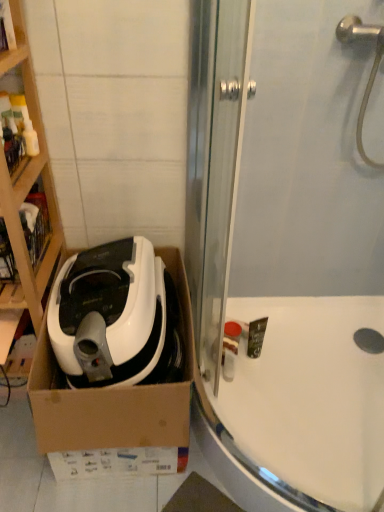
This screenshot has width=384, height=512. What do you see at coordinates (28, 190) in the screenshot? I see `white cardboard box at left` at bounding box center [28, 190].

Where is `white cardboard box at left`? white cardboard box at left is located at coordinates (28, 190).

From the image's perspective, would you say white glossy bathtub at lower right is positioned over transparent glass shower door at upper center?

No, from the image's perspective, white glossy bathtub at lower right is not above transparent glass shower door at upper center.

Is the depth of white glossy bathtub at lower right greater than that of transparent glass shower door at upper center?

Yes, it is.

Is white glossy bathtub at lower right with transparent glass shower door at upper center?

No, white glossy bathtub at lower right is not beside transparent glass shower door at upper center.

Can you tell me how much white glossy bathtub at lower right and transparent glass shower door at upper center differ in facing direction?

The angular difference between white glossy bathtub at lower right and transparent glass shower door at upper center is 41.1 degrees.

Considering the sizes of objects transparent glass shower door at upper center and white matte/soft plastic at left in the image provided, who is shorter, transparent glass shower door at upper center or white matte/soft plastic at left?

white matte/soft plastic at left is shorter.

Is transparent glass shower door at upper center at the left side of white matte/soft plastic at left?

No.

From the image's perspective, is transparent glass shower door at upper center located beneath white matte/soft plastic at left?

No, from the image's perspective, transparent glass shower door at upper center is not below white matte/soft plastic at left.

Which is behind, transparent glass shower door at upper center or white cardboard box at left?

Result: white cardboard box at left.

Is transparent glass shower door at upper center situated inside white cardboard box at left or outside?

transparent glass shower door at upper center lies outside white cardboard box at left.

Identify the location of cabinetry that is behind the transparent glass shower door at upper center. This screenshot has height=512, width=384. (28, 190).

Does point (191, 84) lie in front of point (48, 162)?

Yes.

Find the location of a particular element. This screenshot has height=512, width=384. bath that appears below the white matte/soft plastic at left (from a real-world perspective) is located at coordinates (300, 408).

Looking at their sizes, would you say white glossy bathtub at lower right is wider or thinner than white matte/soft plastic at left?

white glossy bathtub at lower right is wider than white matte/soft plastic at left.

Is white glossy bathtub at lower right positioned with its back to white matte/soft plastic at left?

No, white matte/soft plastic at left is not at the back of white glossy bathtub at lower right.

Considering the relative sizes of white cardboard box at left and white glossy bathtub at lower right in the image provided, is white cardboard box at left thinner than white glossy bathtub at lower right?

Correct, the width of white cardboard box at left is less than that of white glossy bathtub at lower right.

Is white cardboard box at left oriented towards white glossy bathtub at lower right?

No, white cardboard box at left is not oriented towards white glossy bathtub at lower right.

Is white cardboard box at left at the right side of white glossy bathtub at lower right?

In fact, white cardboard box at left is to the left of white glossy bathtub at lower right.

In the scene shown: Is white matte/soft plastic at left at the right side of white glossy bathtub at lower right?

No, white matte/soft plastic at left is not to the right of white glossy bathtub at lower right.

From the image's perspective, is white matte/soft plastic at left over white glossy bathtub at lower right?

Indeed, from the image's perspective, white matte/soft plastic at left is shown above white glossy bathtub at lower right.

From a real-world perspective, is white matte/soft plastic at left below white glossy bathtub at lower right?

No, from a real-world perspective, white matte/soft plastic at left is not under white glossy bathtub at lower right.

Which is in front, white cardboard box at left or white matte/soft plastic at left?

white cardboard box at left is more forward.

What's the angular difference between white cardboard box at left and white matte/soft plastic at left's facing directions?

1.8 degrees.

Could you tell me if white cardboard box at left is facing white matte/soft plastic at left?

No, white cardboard box at left is not oriented towards white matte/soft plastic at left.

From a real-world perspective, is white cardboard box at left positioned above or below white matte/soft plastic at left?

Clearly, from a real-world perspective, white cardboard box at left is above white matte/soft plastic at left.

At what (x,y) coordinates should I click in order to perform the action: click on bath behind the transparent glass shower door at upper center. Please return your answer as a coordinate pair (x, y). Image resolution: width=384 pixels, height=512 pixels. Looking at the image, I should click on (300, 408).

You are a GUI agent. You are given a task and a screenshot of the screen. Output one action in this format:
    pyautogui.click(x=<x>, y=<y>)
    Task: Click on the shower door in front of the white matte/soft plastic at left
    The width and height of the screenshot is (384, 512).
    Given the screenshot: What is the action you would take?
    pyautogui.click(x=284, y=259)

From the image, which object appears to be farther from white matte/soft plastic at left, transparent glass shower door at upper center or white cardboard box at left?

Based on the image, transparent glass shower door at upper center appears to be further to white matte/soft plastic at left.

Looking at the image, which one is located closer to transparent glass shower door at upper center, white glossy bathtub at lower right or white matte/soft plastic at left?

white glossy bathtub at lower right lies closer to transparent glass shower door at upper center than the other object.

Considering their positions, is white glossy bathtub at lower right positioned further to white cardboard box at left than transparent glass shower door at upper center?

Based on the image, white glossy bathtub at lower right appears to be further to white cardboard box at left.

Which object lies further to the anchor point transparent glass shower door at upper center, white matte/soft plastic at left or white glossy bathtub at lower right?

Among the two, white matte/soft plastic at left is located further to transparent glass shower door at upper center.

When comparing their distances from white glossy bathtub at lower right, does white cardboard box at left or white matte/soft plastic at left seem closer?

Among the two, white matte/soft plastic at left is located nearer to white glossy bathtub at lower right.

Which object lies nearer to the anchor point transparent glass shower door at upper center, white cardboard box at left or white matte/soft plastic at left?

white matte/soft plastic at left lies closer to transparent glass shower door at upper center than the other object.

Considering their positions, is white matte/soft plastic at left positioned closer to transparent glass shower door at upper center than white cardboard box at left?

white matte/soft plastic at left.

In the scene shown: Looking at the image, which one is located further to white cardboard box at left, transparent glass shower door at upper center or white matte/soft plastic at left?

transparent glass shower door at upper center lies further to white cardboard box at left than the other object.

In order to click on home appliance located between transparent glass shower door at upper center and white glossy bathtub at lower right in the depth direction in this screenshot , I will do `click(115, 317)`.

Identify the location of home appliance situated between white cardboard box at left and white glossy bathtub at lower right from left to right. This screenshot has width=384, height=512. (115, 317).

I want to click on shower door between white cardboard box at left and white glossy bathtub at lower right from left to right, so click(284, 259).

You are a GUI agent. You are given a task and a screenshot of the screen. Output one action in this format:
    pyautogui.click(x=<x>, y=<y>)
    Task: Click on the home appliance between white cardboard box at left and transparent glass shower door at upper center in the horizontal direction
    Image resolution: width=384 pixels, height=512 pixels.
    Given the screenshot: What is the action you would take?
    pyautogui.click(x=115, y=317)